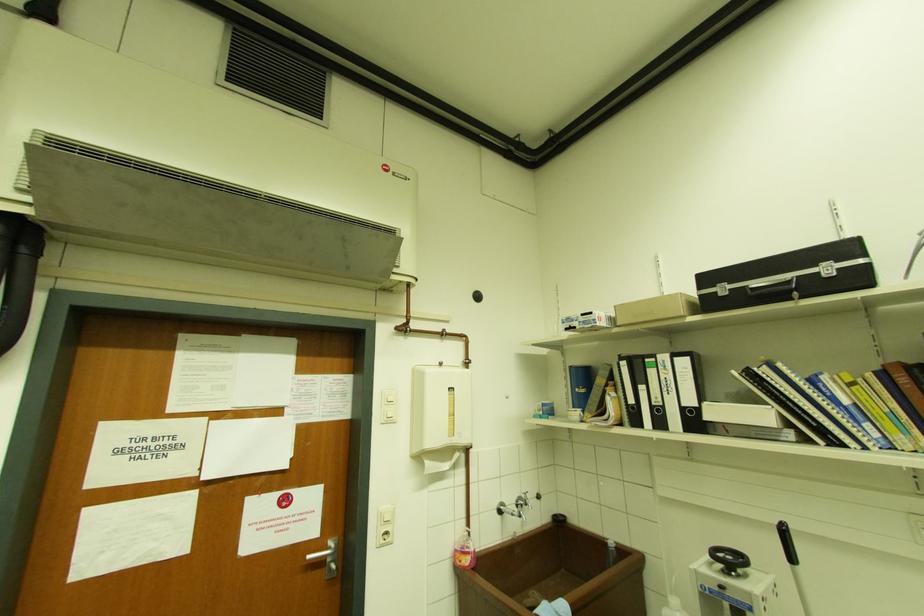
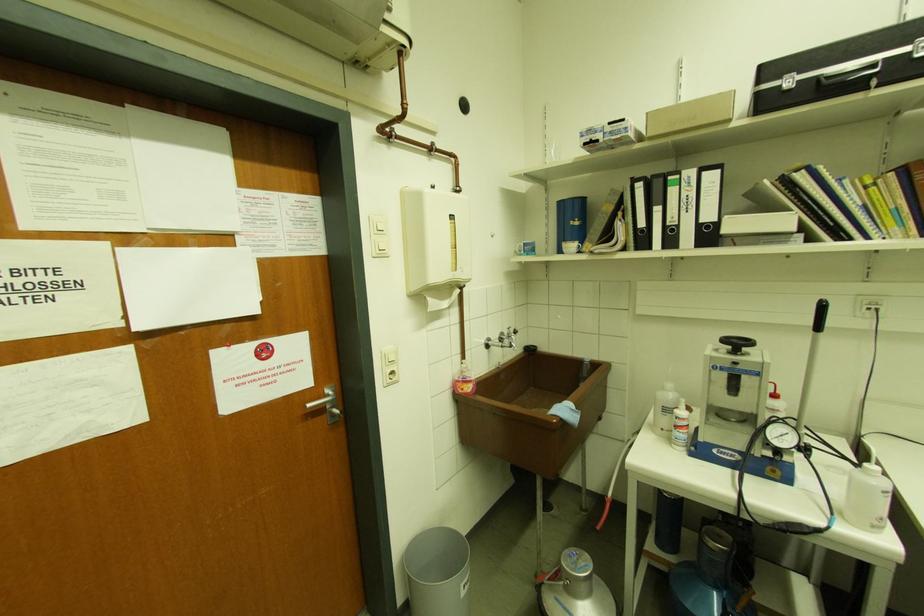
In the second image, find the point that corresponds to point 311,559 in the first image.

(312, 407)